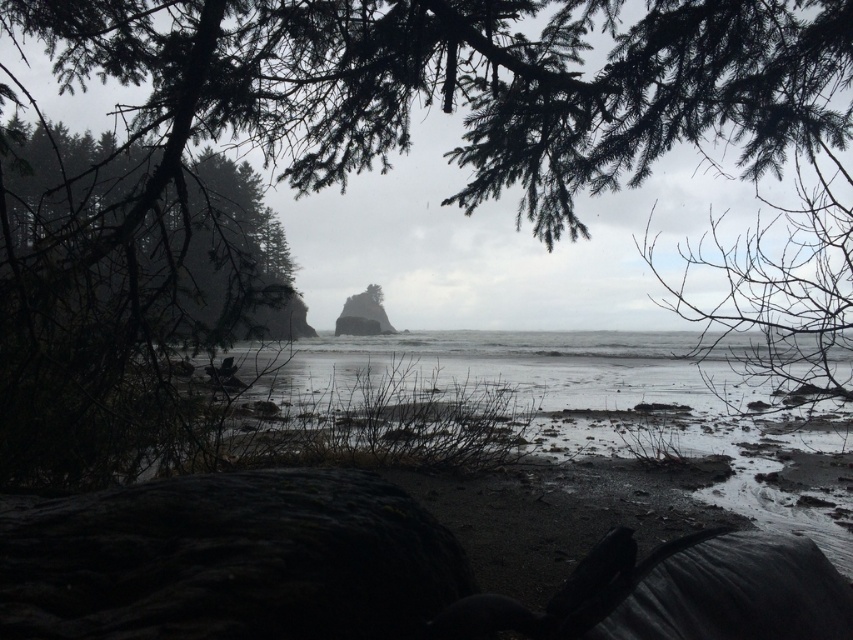
You are standing at the base of the tree with the dark shadowy branches in the foreground. You want to reach the gray matte water at center. According to the coordinates provided, in which direction should you walk to reach it?

The gray matte water at center is located at coordinates point (537, 392). Since the first coordinate is 0.614, which is closer to the right side of the image, and the second coordinate is 0.631, which is closer to the bottom, you should walk towards the lower right direction to reach it.

You are a photographer trying to capture the dark green textured tree at left and the gray matte water at center in the same frame. Based on their positions, will the tree appear above or below the water in your photo?

The gray matte water at center is positioned under the dark green textured tree at left, so the tree will appear above the water in the photo.